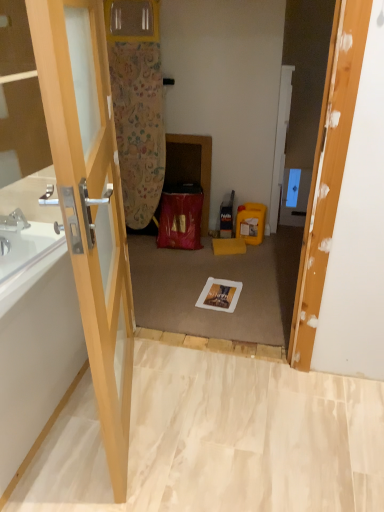
Question: Is white glossy bathtub at left further to camera compared to transparent glass door at left?

Choices:
 (A) yes
 (B) no

Answer: (A)

Question: Is white glossy bathtub at left not close to transparent glass door at left?

Choices:
 (A) yes
 (B) no

Answer: (B)

Question: Can you confirm if white glossy bathtub at left is positioned to the right of transparent glass door at left?

Choices:
 (A) yes
 (B) no

Answer: (B)

Question: Is white glossy bathtub at left bigger than transparent glass door at left?

Choices:
 (A) no
 (B) yes

Answer: (B)

Question: Is white glossy bathtub at left outside of transparent glass door at left?

Choices:
 (A) yes
 (B) no

Answer: (A)

Question: Is the depth of white glossy bathtub at left less than that of transparent glass door at left?

Choices:
 (A) yes
 (B) no

Answer: (B)

Question: Is transparent glass door at left bigger than white glossy bathtub at left?

Choices:
 (A) no
 (B) yes

Answer: (A)

Question: From the image's perspective, does transparent glass door at left appear lower than white glossy bathtub at left?

Choices:
 (A) yes
 (B) no

Answer: (B)

Question: Does transparent glass door at left have a greater width compared to white glossy bathtub at left?

Choices:
 (A) no
 (B) yes

Answer: (A)

Question: From the image's perspective, is transparent glass door at left above white glossy bathtub at left?

Choices:
 (A) yes
 (B) no

Answer: (A)

Question: Considering the relative sizes of transparent glass door at left and white glossy bathtub at left in the image provided, is transparent glass door at left smaller than white glossy bathtub at left?

Choices:
 (A) no
 (B) yes

Answer: (B)

Question: Is the surface of transparent glass door at left in direct contact with white glossy bathtub at left?

Choices:
 (A) no
 (B) yes

Answer: (A)

Question: Is transparent glass door at left wider or thinner than white glossy bathtub at left?

Choices:
 (A) wide
 (B) thin

Answer: (B)